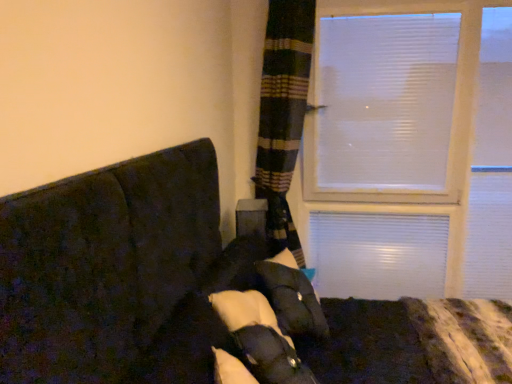
Question: Is dark fabric couch at left positioned in front of white soft pillow at center?

Choices:
 (A) yes
 (B) no

Answer: (A)

Question: Is dark fabric couch at left positioned beyond the bounds of white soft pillow at center?

Choices:
 (A) no
 (B) yes

Answer: (B)

Question: Is dark fabric couch at left positioned behind white soft pillow at center?

Choices:
 (A) yes
 (B) no

Answer: (B)

Question: Considering the relative sizes of dark fabric couch at left and white soft pillow at center in the image provided, is dark fabric couch at left smaller than white soft pillow at center?

Choices:
 (A) no
 (B) yes

Answer: (A)

Question: Is dark fabric couch at left looking in the opposite direction of white soft pillow at center?

Choices:
 (A) yes
 (B) no

Answer: (A)

Question: From the image's perspective, would you say dark fabric couch at left is positioned over white soft pillow at center?

Choices:
 (A) no
 (B) yes

Answer: (A)

Question: Is white soft pillow at center thinner than dark fabric couch at left?

Choices:
 (A) yes
 (B) no

Answer: (A)

Question: Is white soft pillow at center positioned in front of dark fabric couch at left?

Choices:
 (A) no
 (B) yes

Answer: (A)

Question: Does white soft pillow at center have a greater height compared to dark fabric couch at left?

Choices:
 (A) yes
 (B) no

Answer: (B)

Question: Would you say white soft pillow at center contains dark fabric couch at left?

Choices:
 (A) yes
 (B) no

Answer: (B)

Question: Considering the relative sizes of white soft pillow at center and dark fabric couch at left in the image provided, is white soft pillow at center smaller than dark fabric couch at left?

Choices:
 (A) yes
 (B) no

Answer: (A)

Question: From the image's perspective, is white soft pillow at center on dark fabric couch at left?

Choices:
 (A) yes
 (B) no

Answer: (A)

Question: From the image's perspective, is white soft pillow at center above or below dark fabric couch at left?

Choices:
 (A) below
 (B) above

Answer: (B)